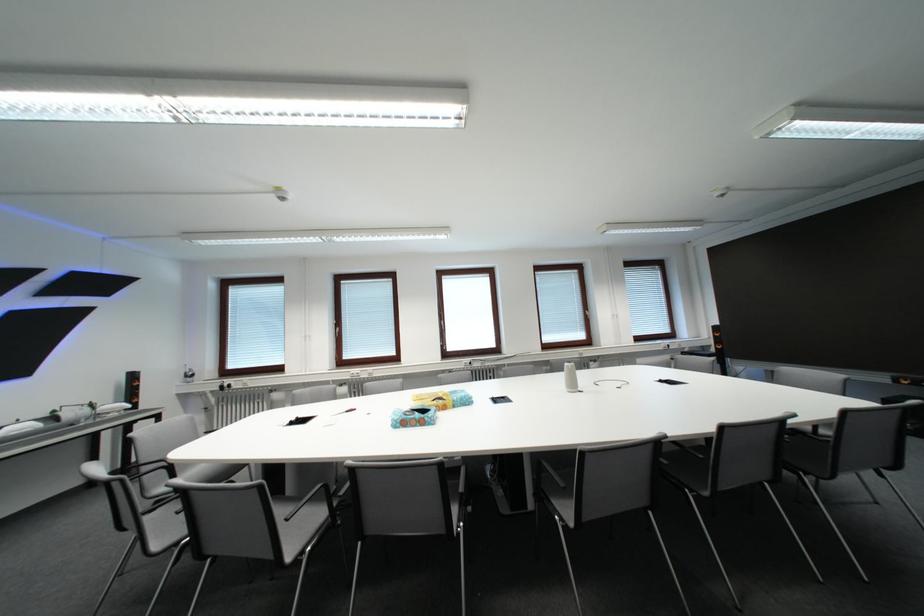
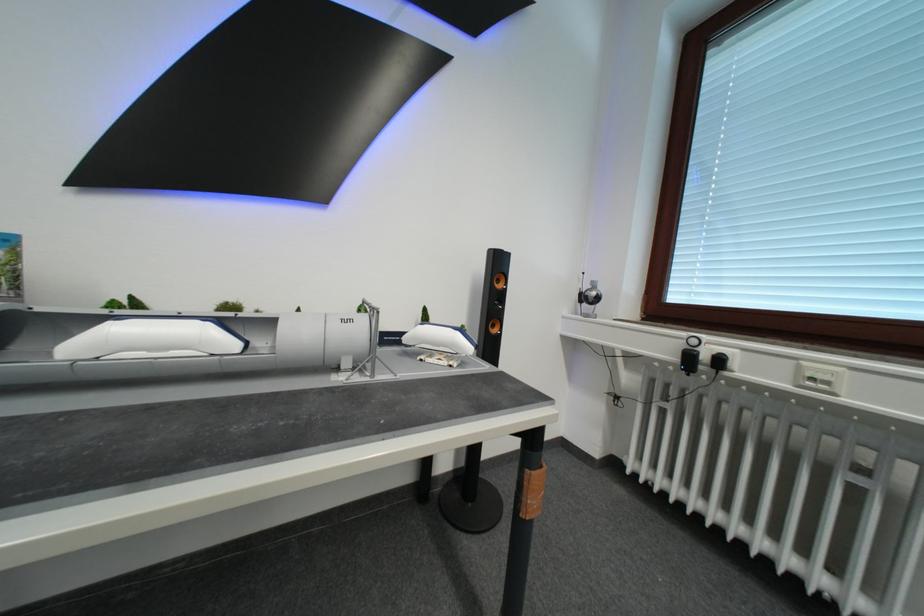
Locate, in the second image, the point that corresponds to pixel 197 378 in the first image.

(592, 301)